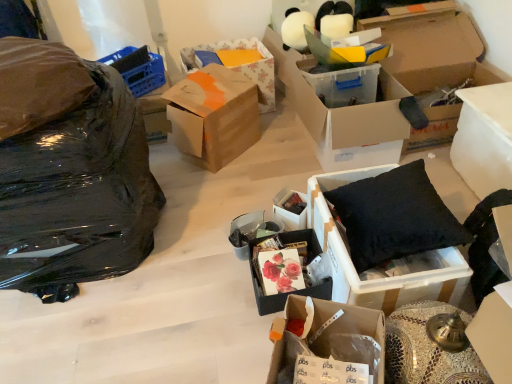
Image resolution: width=512 pixels, height=384 pixels. I want to click on empty space that is to the right of brown cardboard box at center, which ranks as the ninth box in right-to-left order, so click(277, 146).